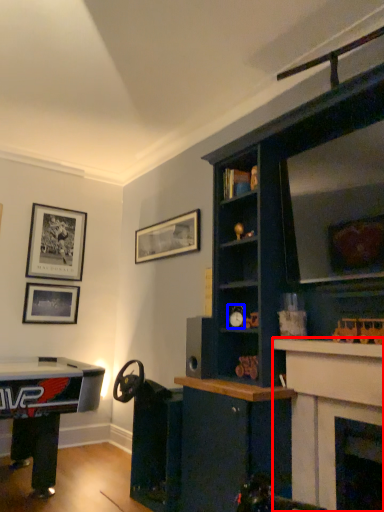
Question: Which point is closer to the camera, fireplace (highlighted by a red box) or toy (highlighted by a blue box)?

Choices:
 (A) fireplace
 (B) toy

Answer: (A)